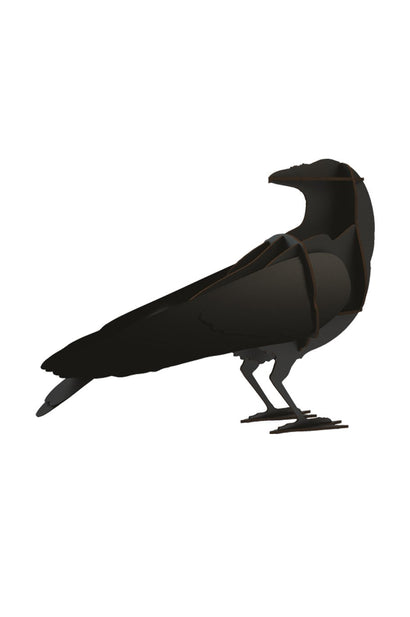
Identify the location of candy holder. [331, 200].